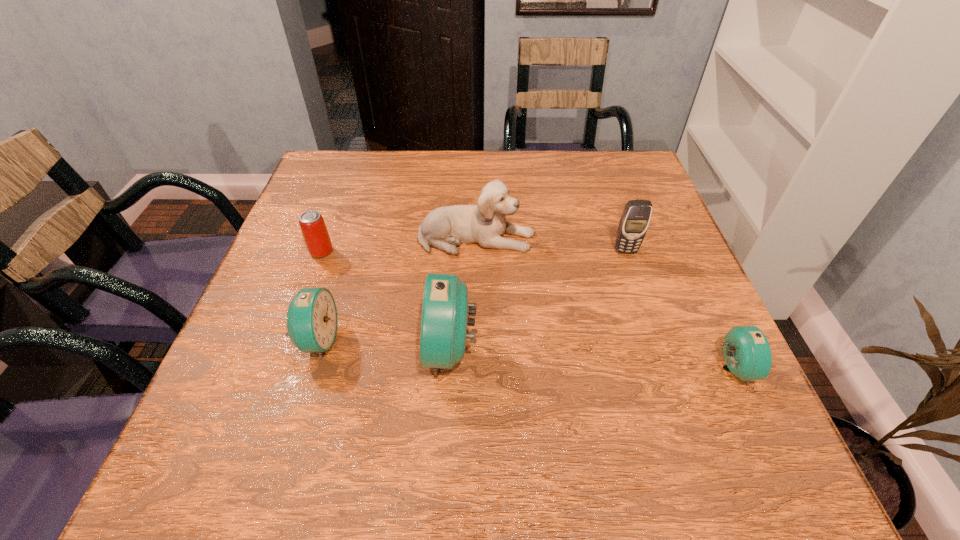
Where is `blank space at the far edge`? blank space at the far edge is located at coordinates (568, 184).

Identify the location of free space at the near edge of the desktop. This screenshot has height=540, width=960. (317, 412).

The width and height of the screenshot is (960, 540). I want to click on vacant area at the left edge, so click(x=333, y=272).

I want to click on vacant region at the right edge of the desktop, so click(642, 268).

Identify the location of free spot at the far left corner of the desktop. (357, 197).

Where is `vacant space at the near left corner of the desktop`? This screenshot has height=540, width=960. vacant space at the near left corner of the desktop is located at coordinates (305, 384).

Locate an element on the screen. This screenshot has height=540, width=960. free space at the far right corner of the desktop is located at coordinates (598, 176).

This screenshot has height=540, width=960. Find the location of `vacant region at the near right corner of the desktop`. vacant region at the near right corner of the desktop is located at coordinates (705, 380).

I want to click on unoccupied area between the cellular telephone and the beer can, so click(473, 252).

Find the location of a particular element. vacant region between the second tallest alarm clock and the cellular telephone is located at coordinates (471, 295).